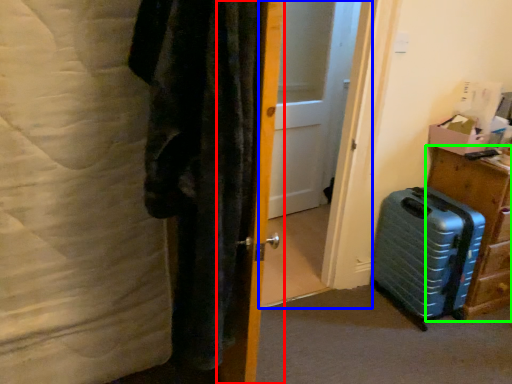
Question: Based on their relative distances, which object is nearer to door (highlighted by a red box)? Choose from screen door (highlighted by a blue box) and furniture (highlighted by a green box).

Choices:
 (A) screen door
 (B) furniture

Answer: (B)